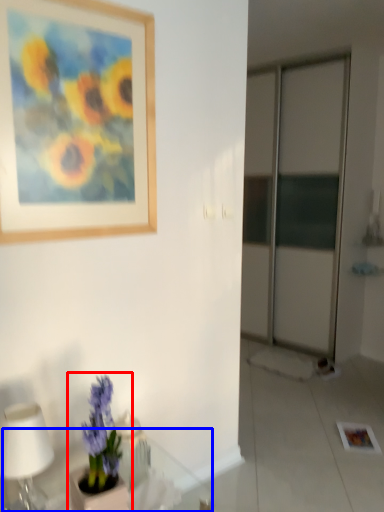
Question: Which object is further to the camera taking this photo, houseplant (highlighted by a red box) or round table (highlighted by a blue box)?

Choices:
 (A) houseplant
 (B) round table

Answer: (A)